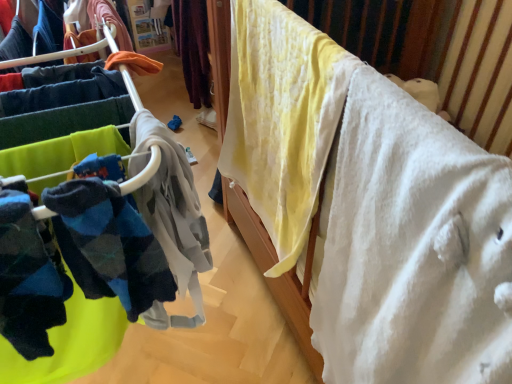
Question: Would you say white soft blanket at upper right is to the left or to the right of soft fleece socks at left in the picture?

Choices:
 (A) left
 (B) right

Answer: (B)

Question: From the image's perspective, is white soft blanket at upper right positioned above or below soft fleece socks at left?

Choices:
 (A) below
 (B) above

Answer: (A)

Question: Which object is positioned farthest from the white soft blanket at upper right?

Choices:
 (A) yellow cotton blanket at upper right
 (B) soft fleece socks at left

Answer: (B)

Question: Based on their relative distances, which object is farther from the white soft blanket at upper right?

Choices:
 (A) soft fleece socks at left
 (B) yellow cotton blanket at upper right

Answer: (A)